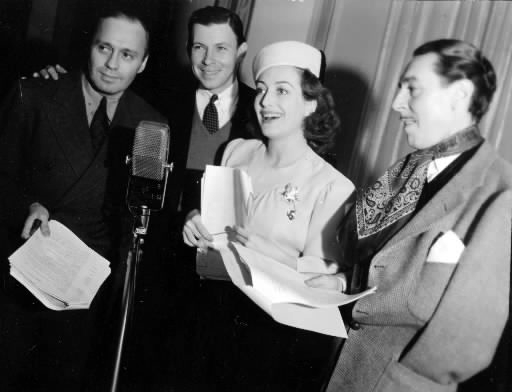
The width and height of the screenshot is (512, 392). In order to click on curtain in this screenshot , I will do `click(406, 36)`.